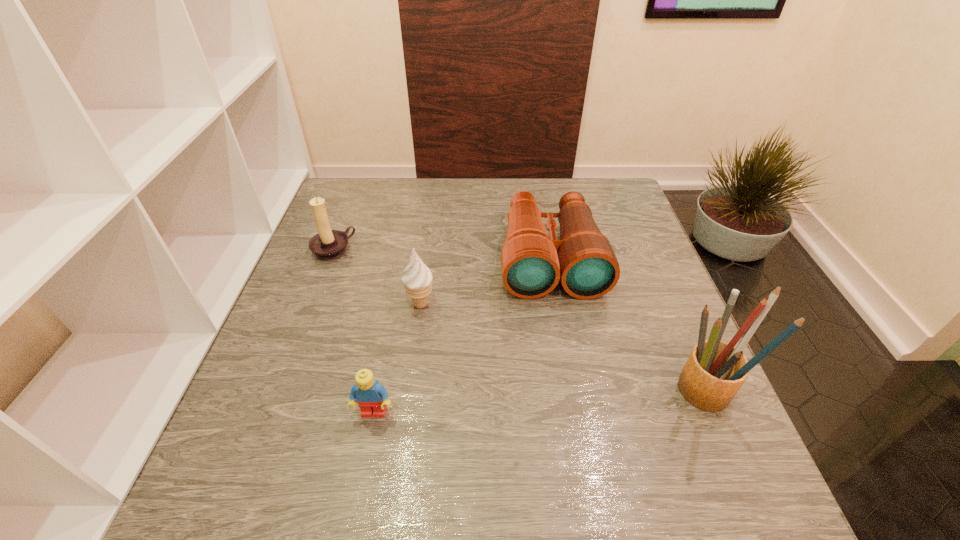
Identify the location of vacant area located on the wick of the leftmost object. This screenshot has width=960, height=540. click(372, 285).

I want to click on free space located through the lenses of the fourth object from left to right, so click(x=566, y=356).

Where is `vacant point located 0.320m through the lenses of the fourth object from left to right`? The height and width of the screenshot is (540, 960). vacant point located 0.320m through the lenses of the fourth object from left to right is located at coordinates (578, 428).

You are a GUI agent. You are given a task and a screenshot of the screen. Output one action in this format:
    pyautogui.click(x=<x>, y=<y>)
    Task: Click on the vacant space situated 0.300m through the lenses of the fourth object from left to right
    
    Given the screenshot: What is the action you would take?
    pyautogui.click(x=576, y=417)

The image size is (960, 540). Identify the location of free space located on the front-facing side of the icecream. (547, 376).

Locate an element on the screen. vacant point located on the front-facing side of the icecream is located at coordinates (482, 339).

Locate an element on the screen. vacant space positioned 0.230m on the front-facing side of the icecream is located at coordinates (517, 359).

Image resolution: width=960 pixels, height=540 pixels. I want to click on Lego located in the near edge section of the desktop, so click(x=371, y=397).

Find the location of `pencil box present at the near edge`. pencil box present at the near edge is located at coordinates (714, 372).

In order to click on object situated at the left edge in this screenshot , I will do (x=328, y=244).